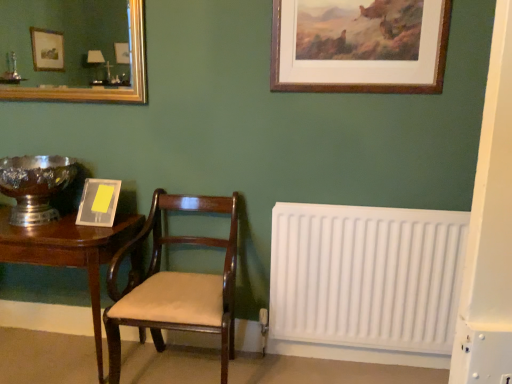
You are a GUI agent. You are given a task and a screenshot of the screen. Output one action in this format:
    pyautogui.click(x=<x>, y=<y>)
    Task: Click on the vacant space that is to the left of matte gray picture frame at left, the second picture frame viewed from the right
    The height and width of the screenshot is (384, 512).
    Given the screenshot: What is the action you would take?
    pyautogui.click(x=59, y=224)